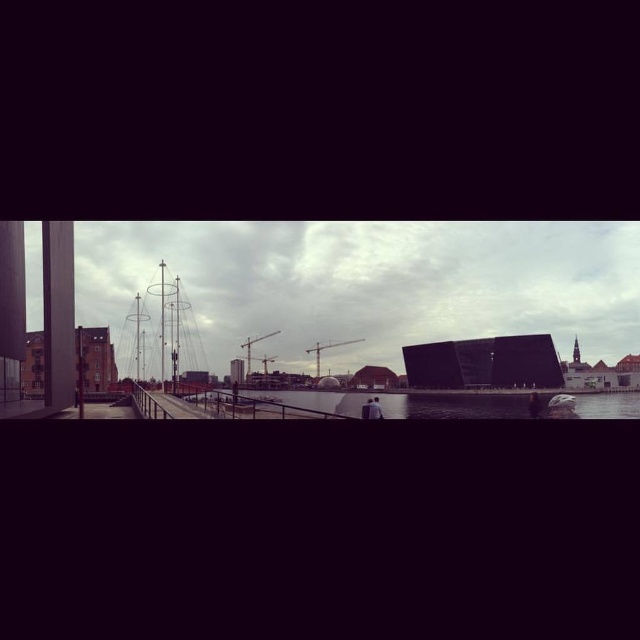
Question: Which point is closer to the camera?

Choices:
 (A) metallic bridge at center
 (B) transparent glass water at center

Answer: (B)

Question: Observing the image, what is the correct spatial positioning of transparent glass water at center in reference to metallic bridge at center?

Choices:
 (A) above
 (B) below

Answer: (B)

Question: In this image, where is transparent glass water at center located relative to metallic bridge at center?

Choices:
 (A) above
 (B) below

Answer: (B)

Question: Does transparent glass water at center have a greater width compared to metallic bridge at center?

Choices:
 (A) no
 (B) yes

Answer: (B)

Question: Which point appears farthest from the camera in this image?

Choices:
 (A) (572, 397)
 (B) (138, 364)

Answer: (B)